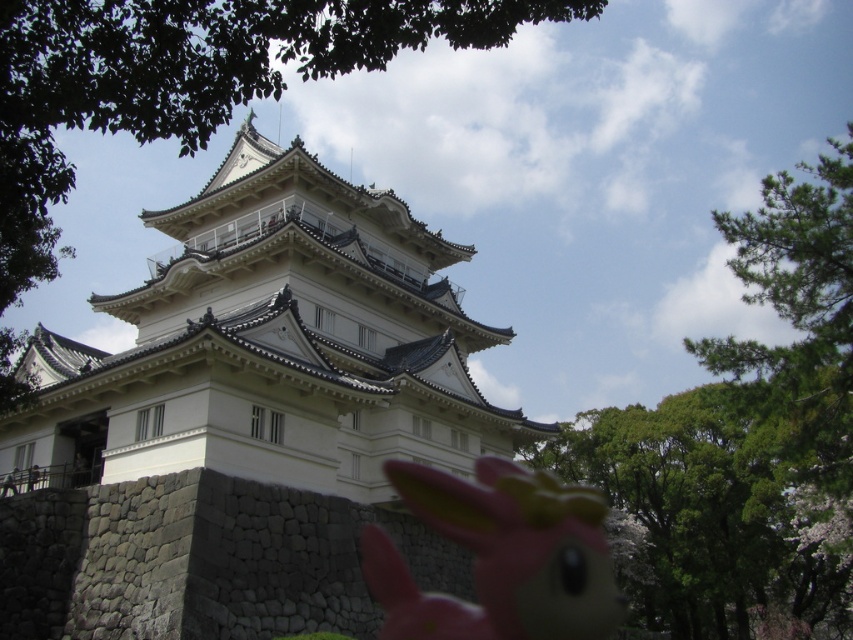
Is point (805, 352) positioned in front of point (38, 205)?

No, (805, 352) is further to viewer.

Does green leafy tree at upper right have a greater height compared to green leafy tree at upper center?

Correct, green leafy tree at upper right is much taller as green leafy tree at upper center.

Is point (849, 579) closer to viewer compared to point (76, 99)?

No.

This screenshot has height=640, width=853. Find the location of `green leafy tree at upper right`. green leafy tree at upper right is located at coordinates (744, 442).

Who is positioned more to the right, green leafy tree at upper center or pink rubber toy at center?

From the viewer's perspective, pink rubber toy at center appears more on the right side.

Locate an element on the screen. The height and width of the screenshot is (640, 853). green leafy tree at upper center is located at coordinates (187, 77).

This screenshot has width=853, height=640. In order to click on green leafy tree at upper center in this screenshot , I will do `click(187, 77)`.

Can you confirm if green leafy tree at upper right is positioned to the right of pink rubber toy at center?

Yes, green leafy tree at upper right is to the right of pink rubber toy at center.

Between green leafy tree at upper right and pink rubber toy at center, which one appears on the right side from the viewer's perspective?

From the viewer's perspective, green leafy tree at upper right appears more on the right side.

Between point (845, 401) and point (524, 531), which one is positioned behind?

Positioned behind is point (524, 531).

You are a GUI agent. You are given a task and a screenshot of the screen. Output one action in this format:
    pyautogui.click(x=<x>, y=<y>)
    Task: Click on the green leafy tree at upper right
    The width and height of the screenshot is (853, 640).
    Given the screenshot: What is the action you would take?
    [744, 442]